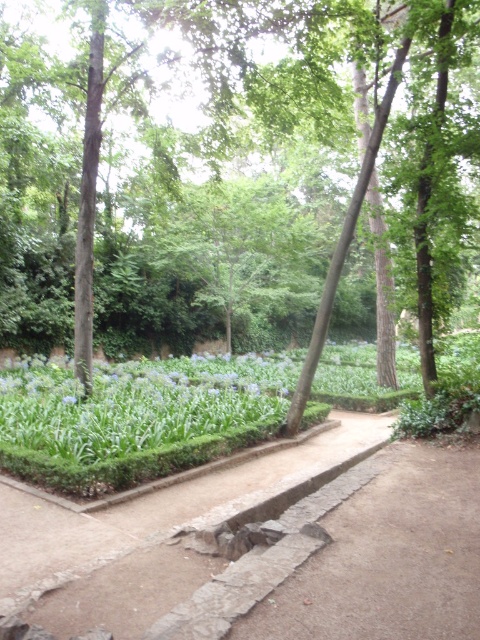
Who is positioned more to the right, brown wood tree at center or blue matte flower at center?

From the viewer's perspective, brown wood tree at center appears more on the right side.

Who is positioned more to the left, brown wood tree at center or blue matte flower at center?

Positioned to the left is blue matte flower at center.

Is point (142, 262) more distant than point (71, 403)?

Yes.

The image size is (480, 640). Identify the location of brown wood tree at center. (192, 268).